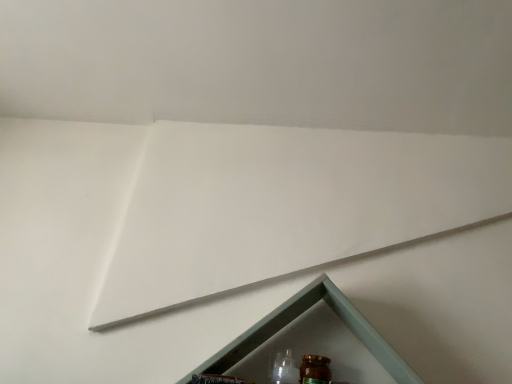
This screenshot has height=384, width=512. In order to click on transparent plastic bottle at lower center in this screenshot , I will do `click(283, 368)`.

The image size is (512, 384). What do you see at coordinates (283, 368) in the screenshot?
I see `transparent plastic bottle at lower center` at bounding box center [283, 368].

Identify the location of transparent plastic bottle at lower center. Image resolution: width=512 pixels, height=384 pixels. (283, 368).